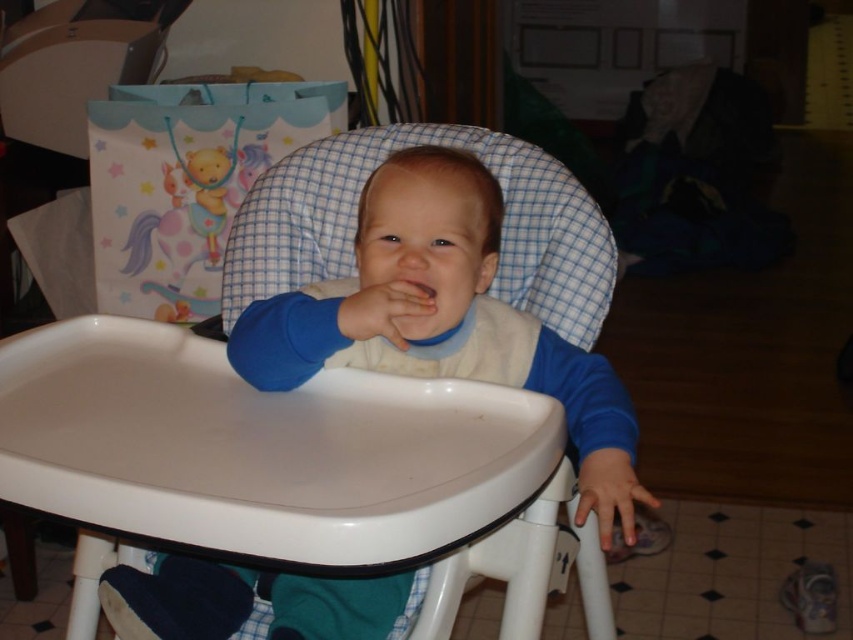
Can you confirm if matte blue sleeve at center is positioned to the right of pink matte flesh at center?

In fact, matte blue sleeve at center is to the left of pink matte flesh at center.

Does matte blue sleeve at center have a greater height compared to pink matte flesh at center?

Yes, matte blue sleeve at center is taller than pink matte flesh at center.

Does point (415, 296) come in front of point (405, 288)?

No, (415, 296) is further to viewer.

You are a GUI agent. You are given a task and a screenshot of the screen. Output one action in this format:
    pyautogui.click(x=<x>, y=<y>)
    Task: Click on the matte blue sleeve at center
    
    Given the screenshot: What is the action you would take?
    click(389, 312)

Between blue cotton bib at center and pink matte flesh at center, which one has less height?

pink matte flesh at center is shorter.

Where is `blue cotton bib at center`? blue cotton bib at center is located at coordinates (436, 304).

Locate an element on the screen. This screenshot has height=640, width=853. blue cotton bib at center is located at coordinates (436, 304).

Is smooth skin hand at lower right further to the viewer compared to pink matte flesh at center?

No, it is in front of pink matte flesh at center.

Which is in front, point (596, 512) or point (403, 291)?

Positioned in front is point (596, 512).

The width and height of the screenshot is (853, 640). What do you see at coordinates (610, 492) in the screenshot? I see `smooth skin hand at lower right` at bounding box center [610, 492].

The width and height of the screenshot is (853, 640). In order to click on smooth skin hand at lower right in this screenshot , I will do `click(610, 492)`.